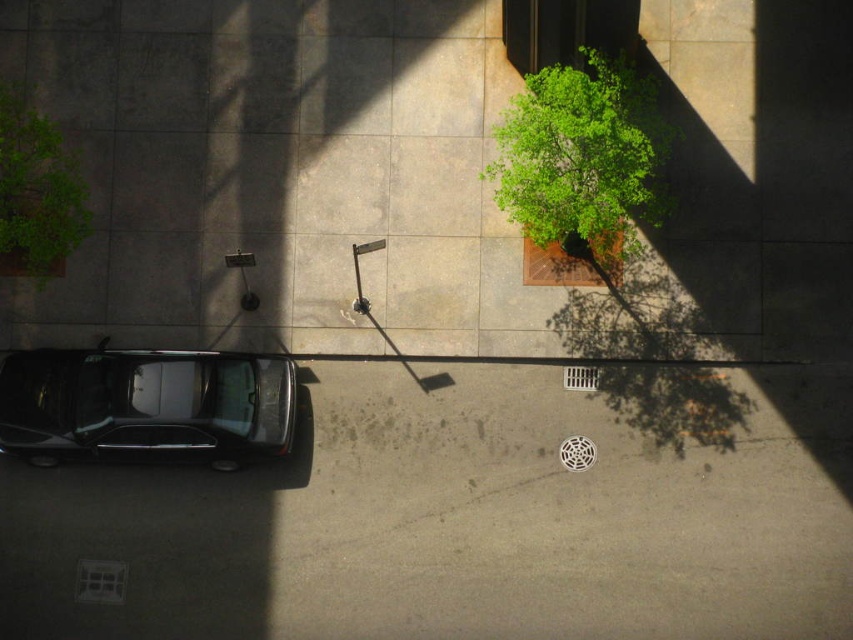
You are a delivery drone flying over an urban area. You need to deliver a package to a location near the green leafy tree at upper center. However, you must avoid flying over the green leafy plant at upper left. Which direction should you head to ensure you stay clear of the plant?

The green leafy tree at upper center is located above the green leafy plant at upper left. To avoid flying over the plant, you should head in a direction away from the upper left area, such as moving towards the upper center or right side of the scene.

You are standing at the point closer to the camera in the image. Which point are you at, point (538, 113) or point (4, 104)?

You are at point (538, 113) because it is closer to the camera than point (4, 104).

You are a pedestrian standing on the sidewalk and want to walk towards the green leafy tree at upper center. Is the shiny black car at lower left blocking your path?

The shiny black car at lower left is located below the green leafy tree at upper center, so it is positioned between you and the tree. This means the shiny black car at lower left is blocking your path to the green leafy tree at upper center.